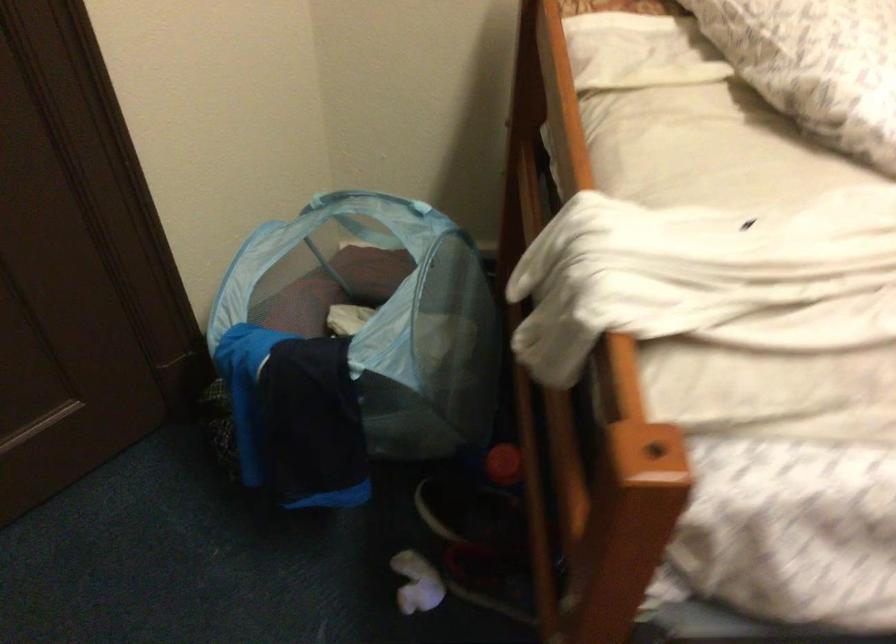
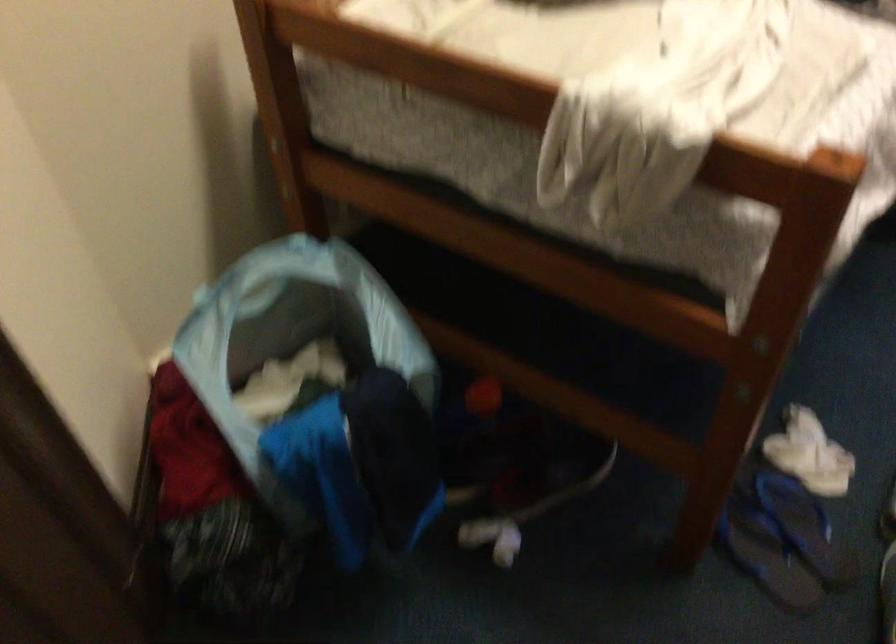
Question: The camera is either moving clockwise (left) or counter-clockwise (right) around the object. The first image is from the beginning of the video and the second image is from the end. Is the camera moving left or right when shooting the video?

Choices:
 (A) Left
 (B) Right

Answer: (A)